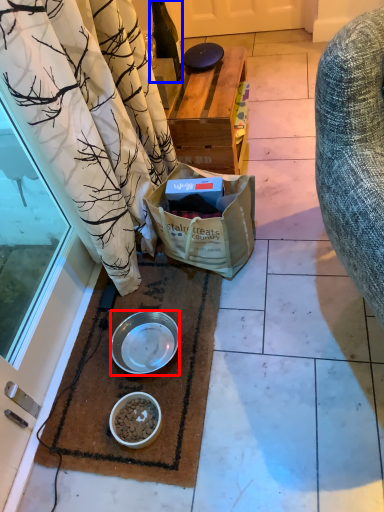
Question: Which object appears farthest to the camera in this image, bowl (highlighted by a red box) or bottle (highlighted by a blue box)?

Choices:
 (A) bowl
 (B) bottle

Answer: (B)